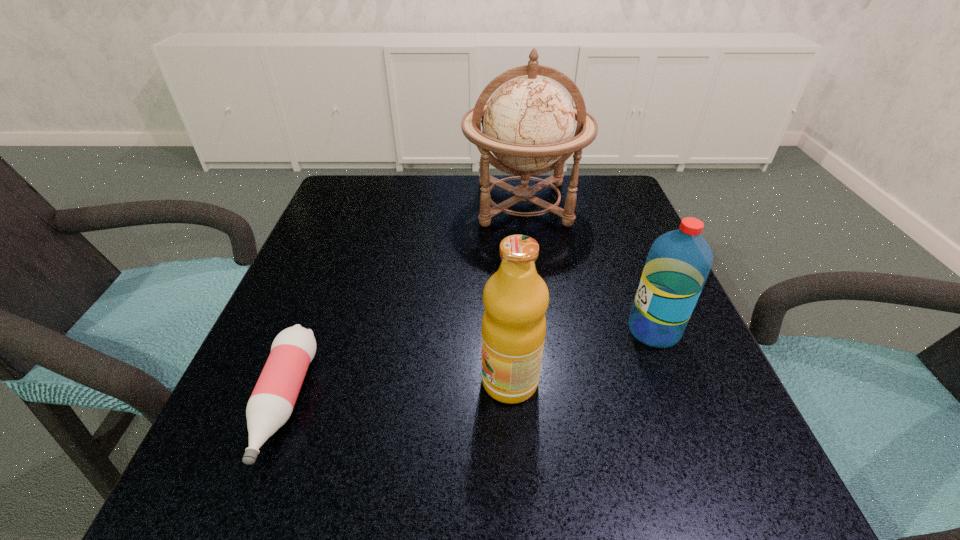
At what (x,y) coordinates should I click in order to perform the action: click on the farthest object. Please return your answer as a coordinate pair (x, y). The image size is (960, 540). Looking at the image, I should click on (528, 124).

Locate an element on the screen. This screenshot has height=540, width=960. globe is located at coordinates (528, 124).

Identify the location of the third shortest object. The image size is (960, 540). (516, 298).

Where is `the rightmost object`? the rightmost object is located at coordinates (679, 261).

The height and width of the screenshot is (540, 960). Identify the location of the third tallest object. (679, 261).

The height and width of the screenshot is (540, 960). Identify the location of the shortest object. (272, 401).

You are a GUI agent. You are given a task and a screenshot of the screen. Output one action in this format:
    pyautogui.click(x=<x>, y=<y>)
    Task: Click on the bottle
    This screenshot has width=960, height=540.
    Given the screenshot: What is the action you would take?
    pyautogui.click(x=272, y=401)

Locate an element on the screen. The image size is (960, 540). vacant region located 0.160m on the front-facing side of the farthest object is located at coordinates (535, 289).

At what (x,y) coordinates should I click in order to perform the action: click on blank area located 0.350m on the front label of the fruit juice. Please return your answer as a coordinate pair (x, y). Image resolution: width=960 pixels, height=540 pixels. Looking at the image, I should click on (252, 381).

What are the coordinates of `blank space located 0.320m on the front label of the fruit juice` in the screenshot? It's located at (272, 381).